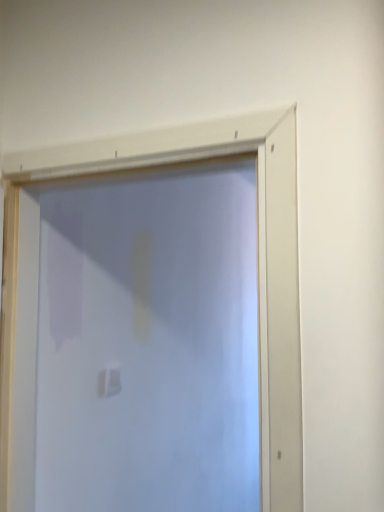
The width and height of the screenshot is (384, 512). Describe the element at coordinates (260, 262) in the screenshot. I see `transparent glass window at center` at that location.

Based on the photo, measure the distance between transparent glass window at center and camera.

27.94 inches.

I want to click on transparent glass window at center, so click(260, 262).

Locate an element on the screen. Image resolution: width=384 pixels, height=512 pixels. transparent glass window at center is located at coordinates (260, 262).